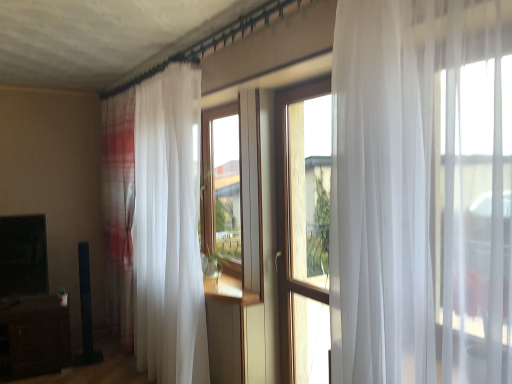
Question: In terms of height, does white sheer curtain at left look taller or shorter compared to wooden window at center?

Choices:
 (A) short
 (B) tall

Answer: (B)

Question: Which is correct: white sheer curtain at left is inside wooden window at center, or outside of it?

Choices:
 (A) outside
 (B) inside

Answer: (A)

Question: Considering the real-world distances, which object is farthest from the brown wood entertainment center at lower left?

Choices:
 (A) white sheer curtain at left
 (B) wooden window at center

Answer: (B)

Question: Considering the real-world distances, which object is closest to the brown wood entertainment center at lower left?

Choices:
 (A) white sheer curtain at left
 (B) wooden window at center

Answer: (A)